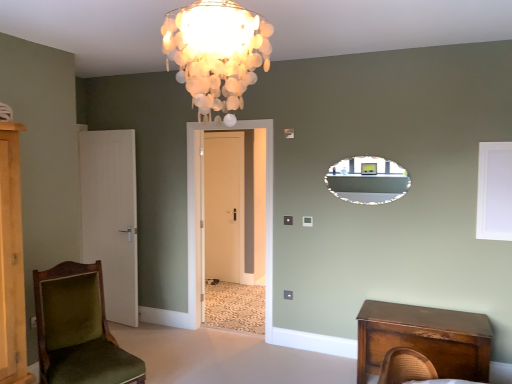
This screenshot has height=384, width=512. In order to click on empty space that is ontop of matte black mirror at upper center in this screenshot , I will do `click(372, 154)`.